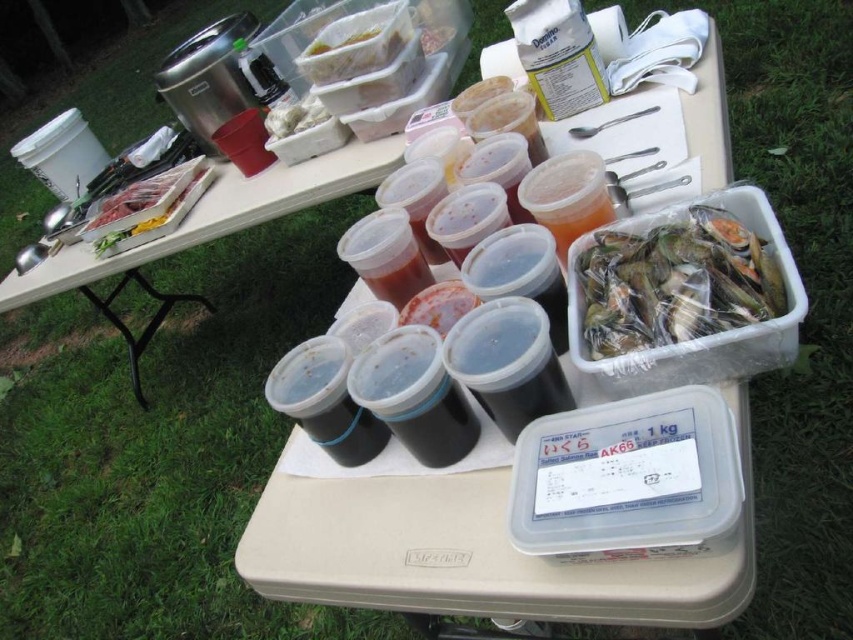
Question: Which point is farther to the camera?

Choices:
 (A) (379, 168)
 (B) (477, 493)
 (C) (624, 250)
 (D) (317, 44)

Answer: (D)

Question: Can you confirm if clear plastic container at upper center is positioned to the left of white plastic bag at upper center?

Choices:
 (A) no
 (B) yes

Answer: (A)

Question: Which point is farther to the camera?

Choices:
 (A) (640, 609)
 (B) (389, 42)
 (C) (288, 115)

Answer: (C)

Question: Estimate the real-world distances between objects in this image. Which object is closer to the clear plastic bag of fish at center-right?

Choices:
 (A) clear plastic container at upper center
 (B) translucent plastic cup at center
 (C) clear plastic containers at center
 (D) clear plastic cups at center

Answer: (C)

Question: Does clear plastic containers at center appear on the left side of white plastic bag at upper center?

Choices:
 (A) no
 (B) yes

Answer: (A)

Question: Can you confirm if translucent plastic cup at center is wider than clear plastic container at upper center?

Choices:
 (A) no
 (B) yes

Answer: (A)